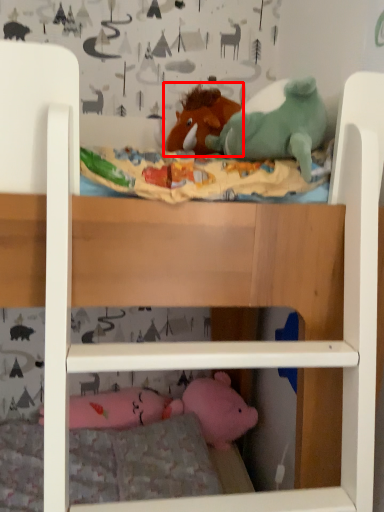
Question: Observing the image, what is the correct spatial positioning of toy (annotated by the red box) in reference to pillow?

Choices:
 (A) right
 (B) left

Answer: (A)